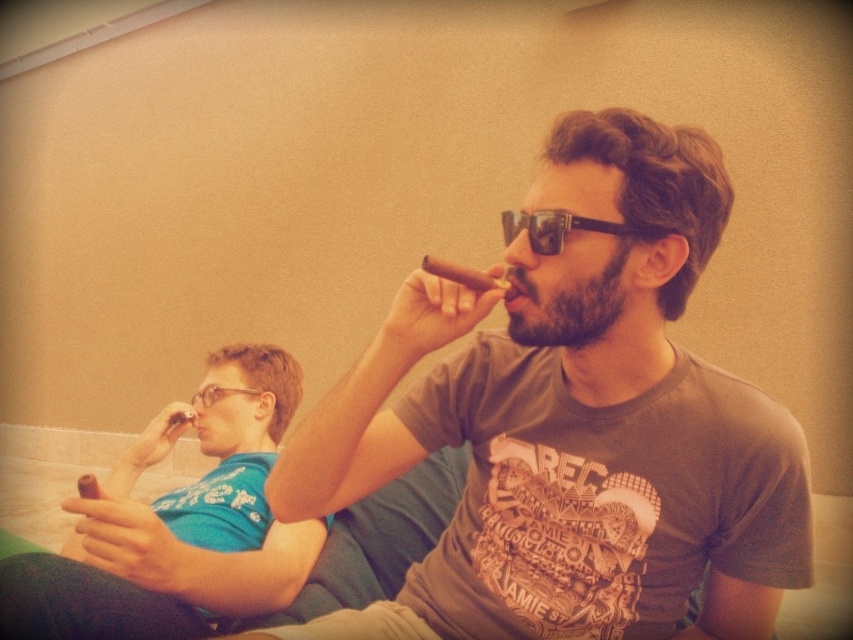
You are a photographer setting up a shoot in this scene. You need to place a small prop between the matte blue shirt at left and the black plastic sunglasses at center. Based on their positions, where should you place the prop so it is between them?

The matte blue shirt at left is located below the black plastic sunglasses at center, so placing the prop between them would require positioning it above the matte blue shirt at left and below the black plastic sunglasses at center.

You are a photographer setting up a shot in this scene. You need to ensure that the matte blue shirt at left and the black plastic sunglasses at center are both in focus. Given their relative sizes in the frame, which object should you adjust your focus on first to ensure proper depth of field?

The matte blue shirt at left is much taller than the black plastic sunglasses at center, so you should focus on the matte blue shirt at left first to ensure proper depth of field since it is larger in the frame.